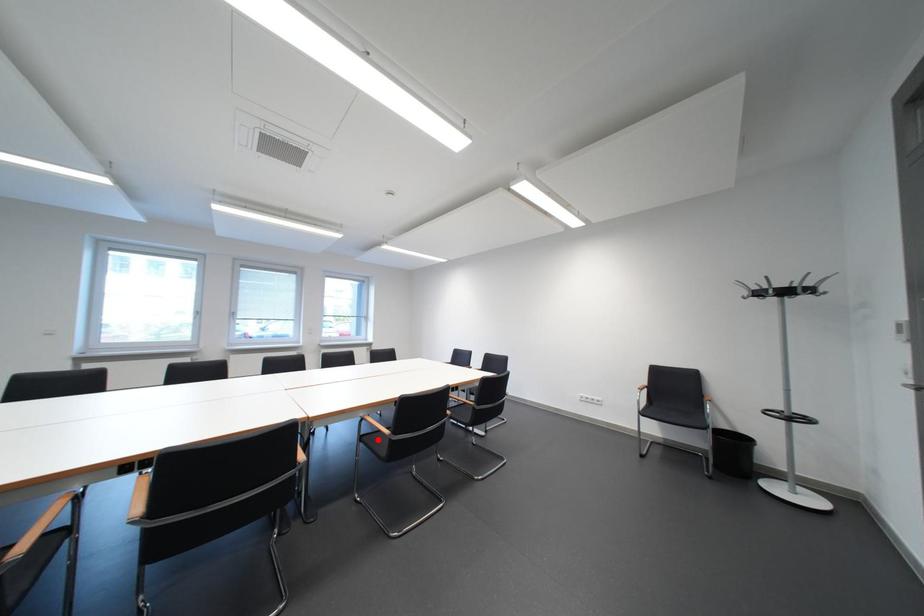
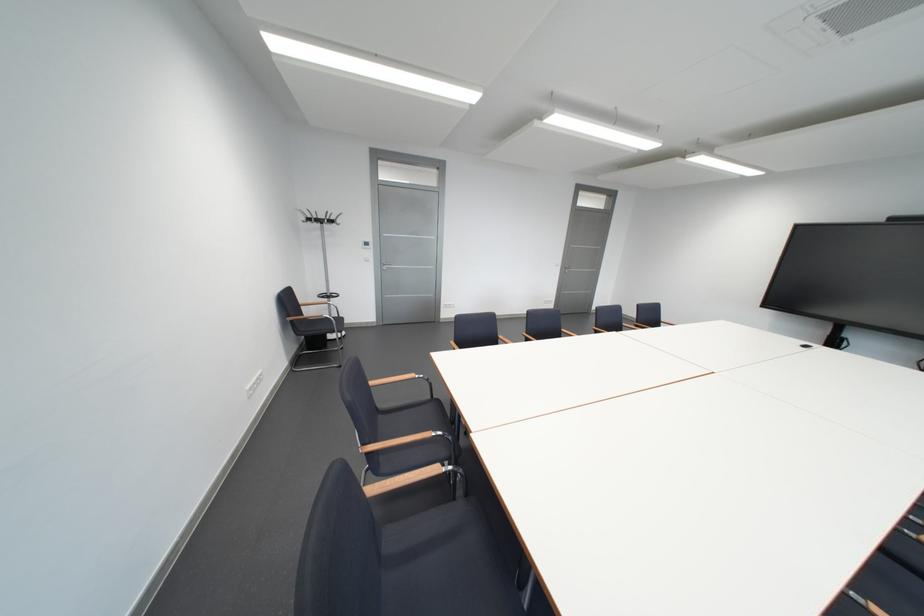
Question: I am providing you with two images of the same scene from different viewpoints. A red point is marked on the first image. Is the red point's position out of view in image 2?

Choices:
 (A) Yes
 (B) No

Answer: (A)